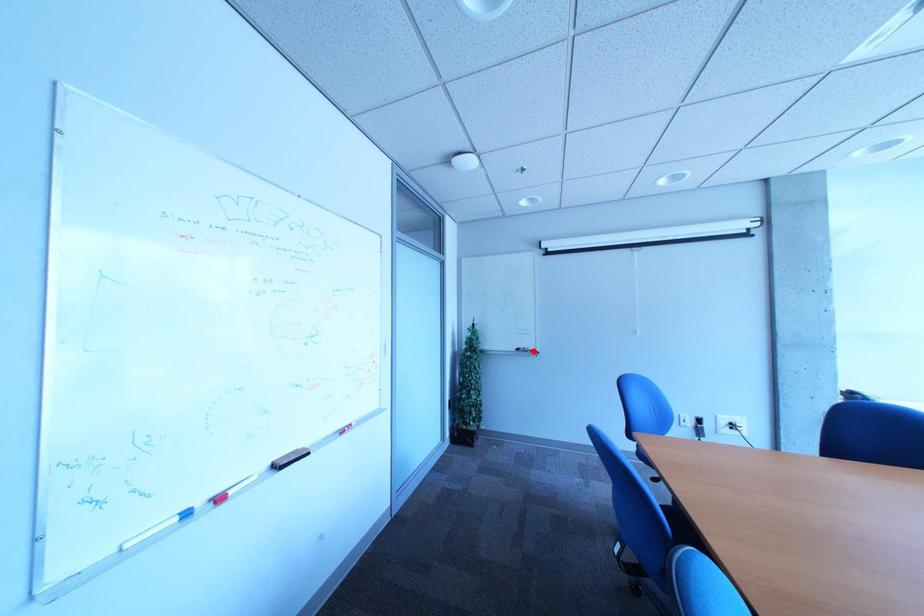
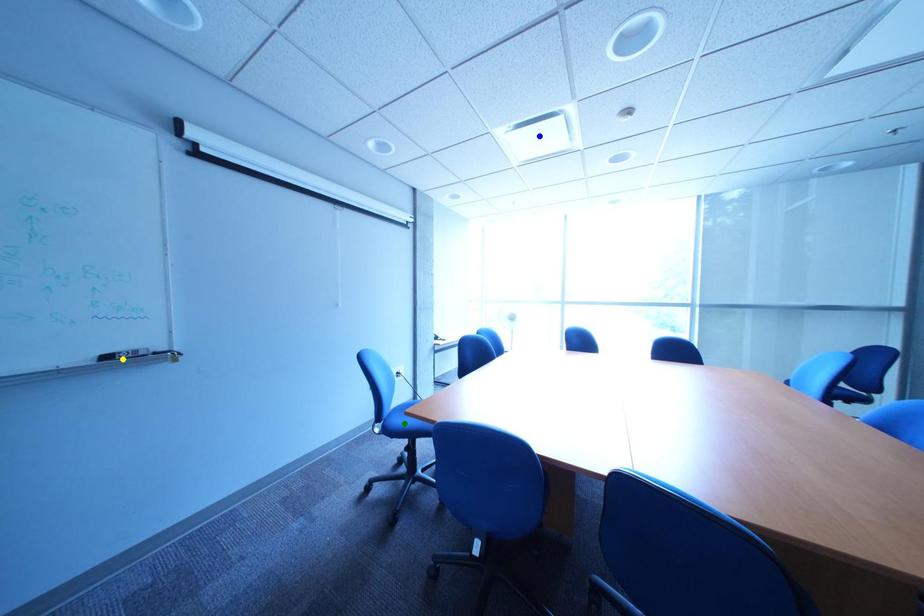
Question: I am providing you with two images of the same scene from different viewpoints. A red point is marked on the first image. You are given multiple points on the second image. Which point in image 2 is actually the same real-world point as the red point in image 1?

Choices:
 (A) yellow point
 (B) blue point
 (C) green point

Answer: (A)